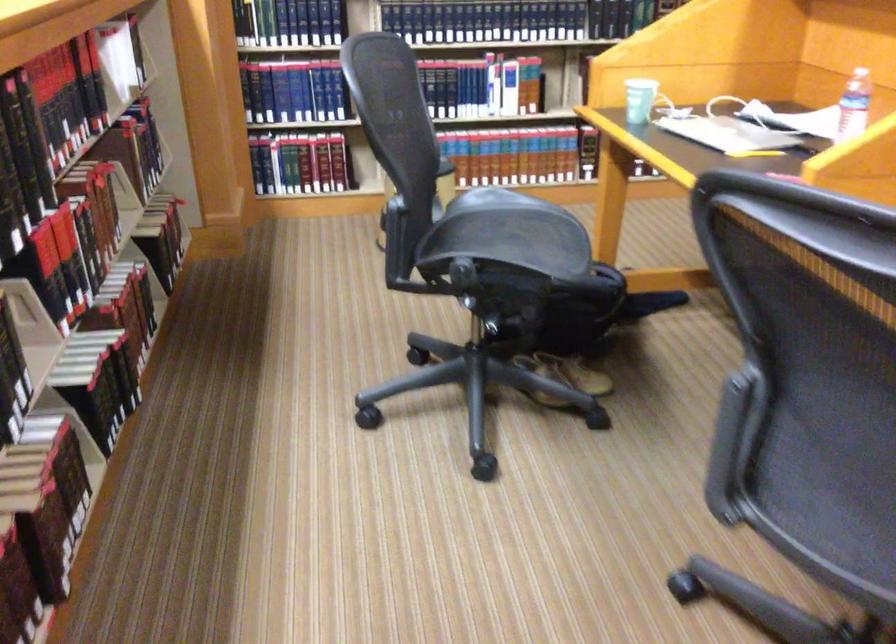
Where is `tan shoe`? This screenshot has height=644, width=896. tan shoe is located at coordinates (564, 377).